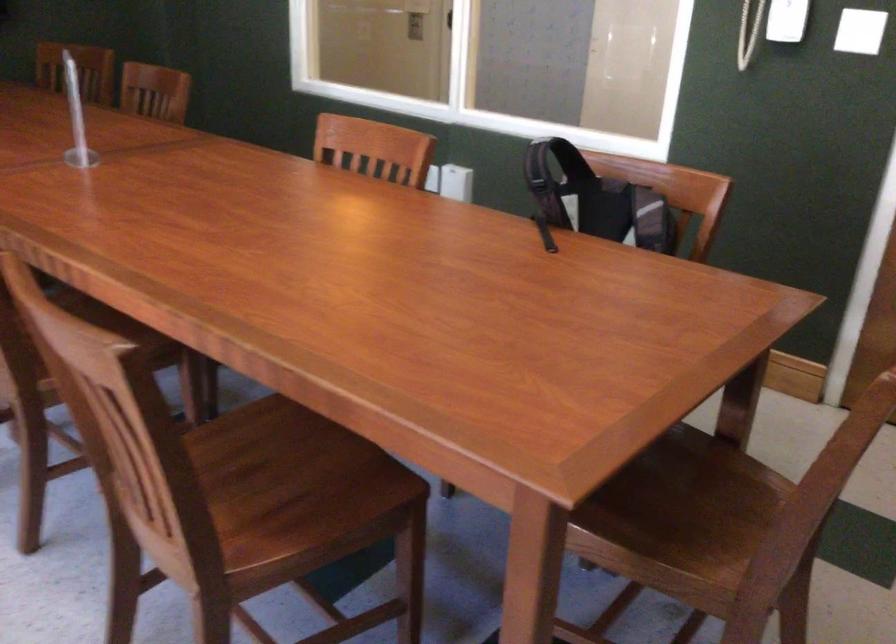
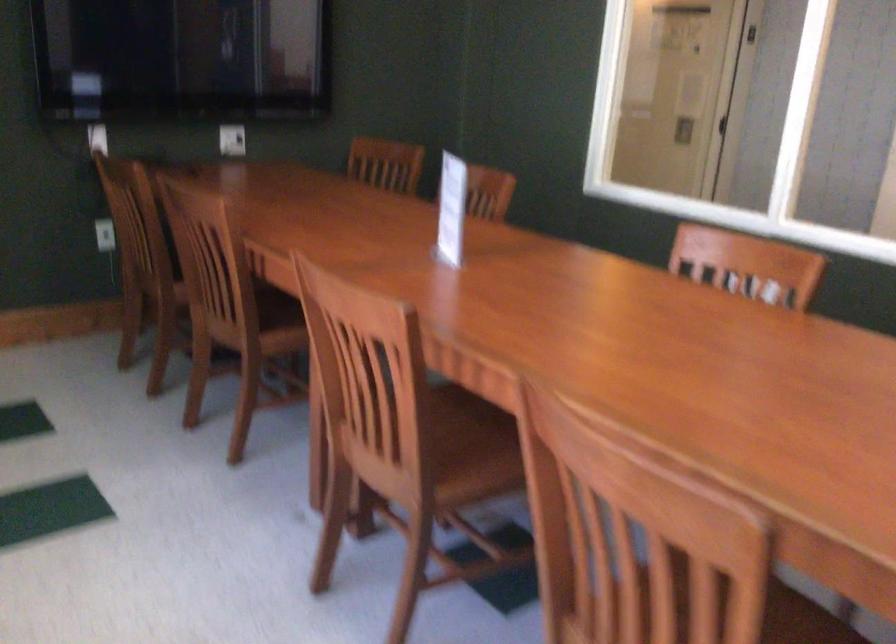
Question: In a continuous first-person perspective shot, in which direction is the camera moving?

Choices:
 (A) Left
 (B) Right
 (C) Forward
 (D) Backward

Answer: (A)